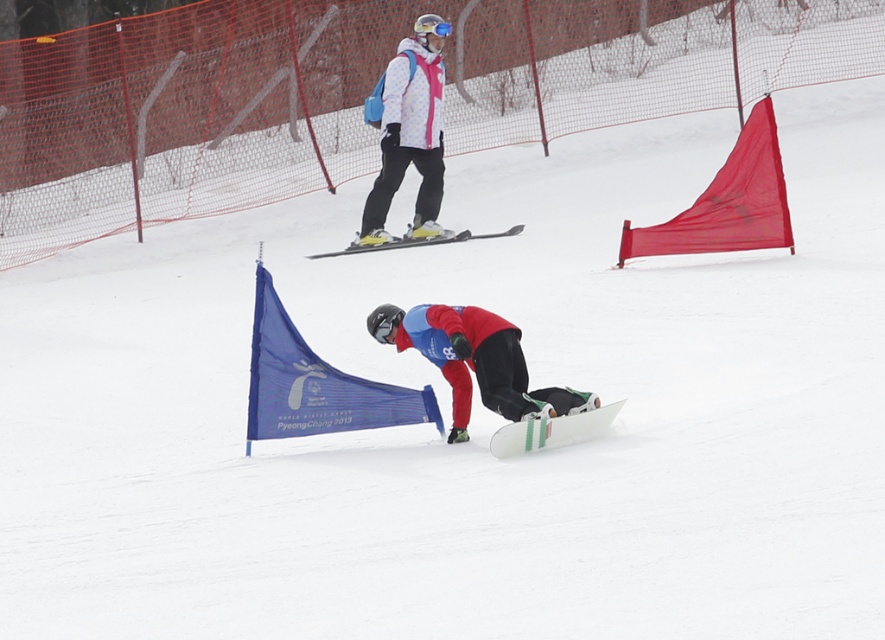
Question: Is white matte snowboard at center wider than blue matte goggles at center?

Choices:
 (A) yes
 (B) no

Answer: (A)

Question: Is matte pink jacket at upper center below white matte snowboard at center?

Choices:
 (A) no
 (B) yes

Answer: (A)

Question: Is white matte snowboard at center below yellow metallic skis at center?

Choices:
 (A) no
 (B) yes

Answer: (B)

Question: Based on their relative distances, which object is nearer to the matte pink jacket at upper center?

Choices:
 (A) blue matte goggles at center
 (B) red matte snowboard at center
 (C) white matte snowboard at center

Answer: (A)

Question: Which point is farther to the camera?

Choices:
 (A) coord(432,20)
 (B) coord(354,250)

Answer: (B)

Question: Which point is farther to the camera?

Choices:
 (A) (460, 440)
 (B) (374, 244)

Answer: (B)